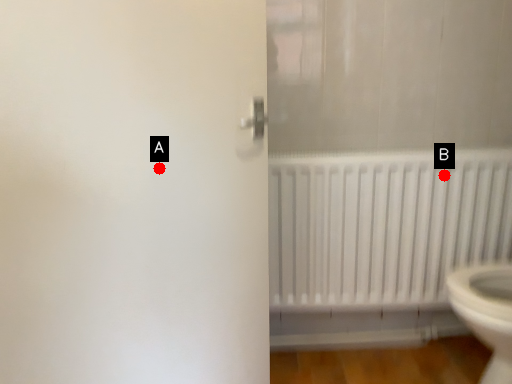
Question: Two points are circled on the image, labeled by A and B beside each circle. Which point is farther from the camera taking this photo?

Choices:
 (A) A is further
 (B) B is further

Answer: (B)